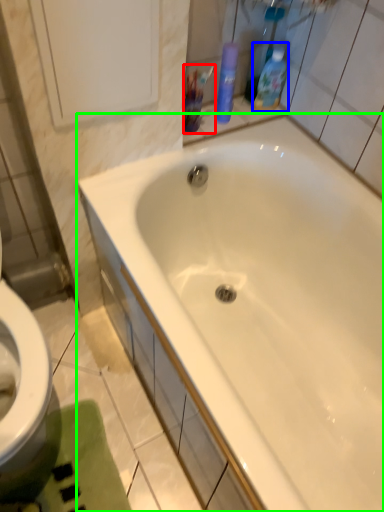
Question: Estimate the real-world distances between objects in this image. Which object is farther from mouthwash (highlighted by a red box), cleaning product (highlighted by a blue box) or bathtub (highlighted by a green box)?

Choices:
 (A) cleaning product
 (B) bathtub

Answer: (B)